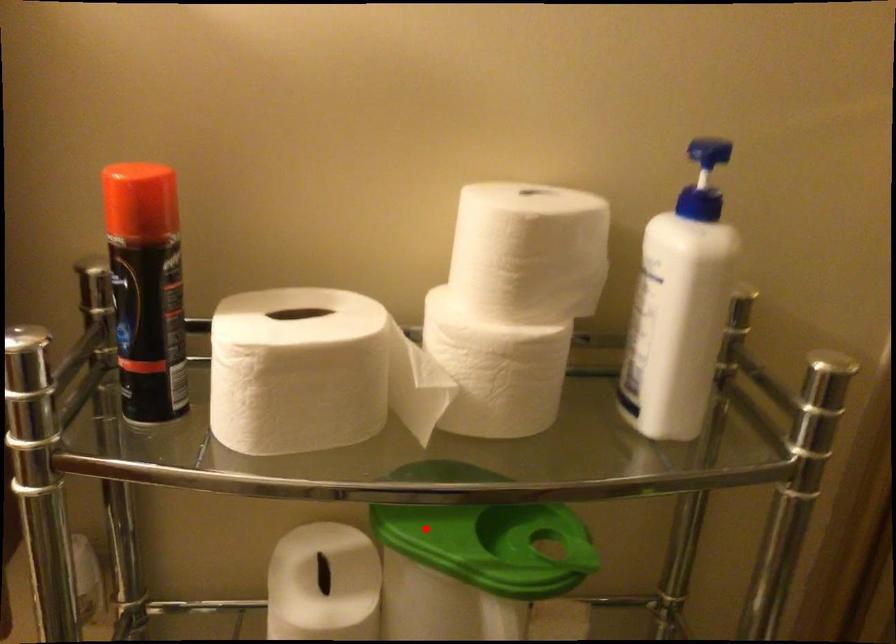
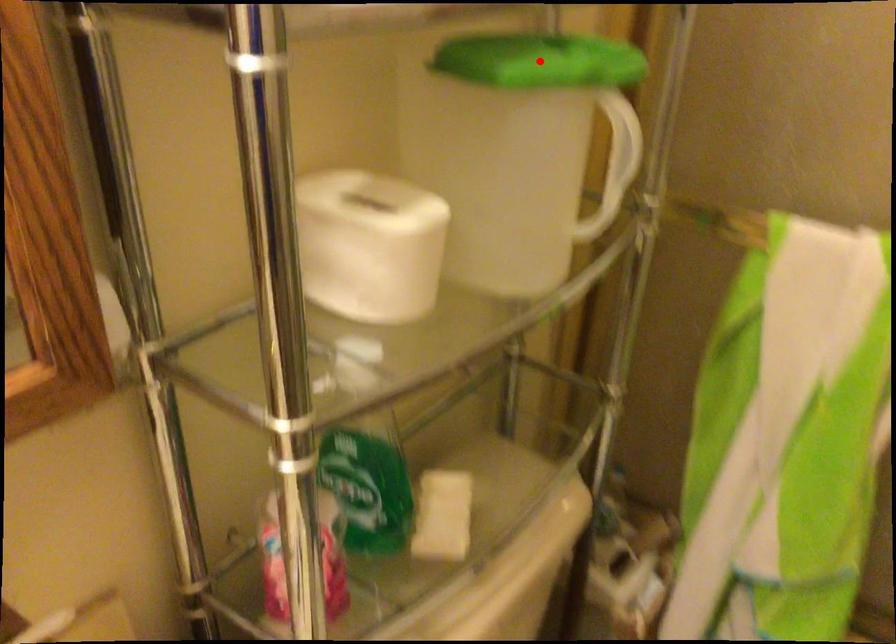
I am providing you with two images of the same scene from different viewpoints. A red point is marked on the first image and another point is marked on the second image. Is the red point in image1 aligned with the point shown in image2?

Yes